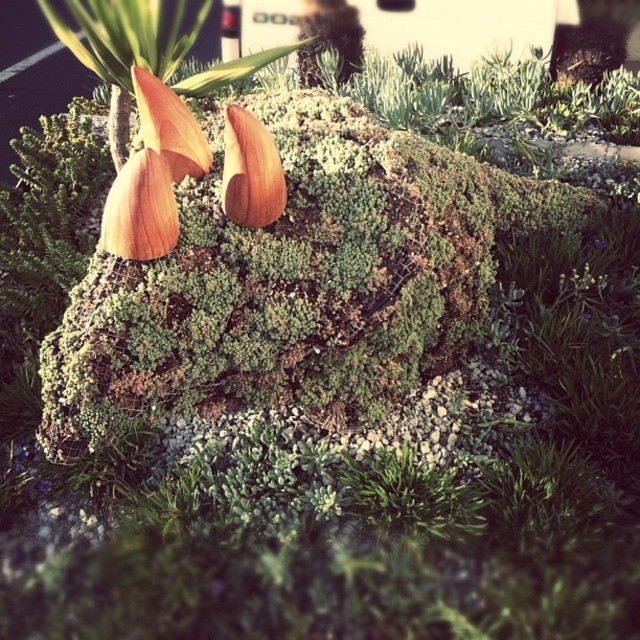
Question: Among these objects, which one is farthest from the camera?

Choices:
 (A) wooden petal at center
 (B) wooden flower at center

Answer: (A)

Question: Which of the following is the farthest from the observer?

Choices:
 (A) matte orange petal at center
 (B) wooden petal at center
 (C) wooden flower at center

Answer: (A)

Question: Which point appears closest to the camera in this image?

Choices:
 (A) (269, 157)
 (B) (198, 145)

Answer: (A)

Question: Does wooden petal at center appear over matte orange petal at center?

Choices:
 (A) yes
 (B) no

Answer: (B)

Question: Can you confirm if wooden flower at center is thinner than matte orange petal at center?

Choices:
 (A) yes
 (B) no

Answer: (A)

Question: Is the position of wooden petal at center more distant than that of matte orange petal at center?

Choices:
 (A) yes
 (B) no

Answer: (B)